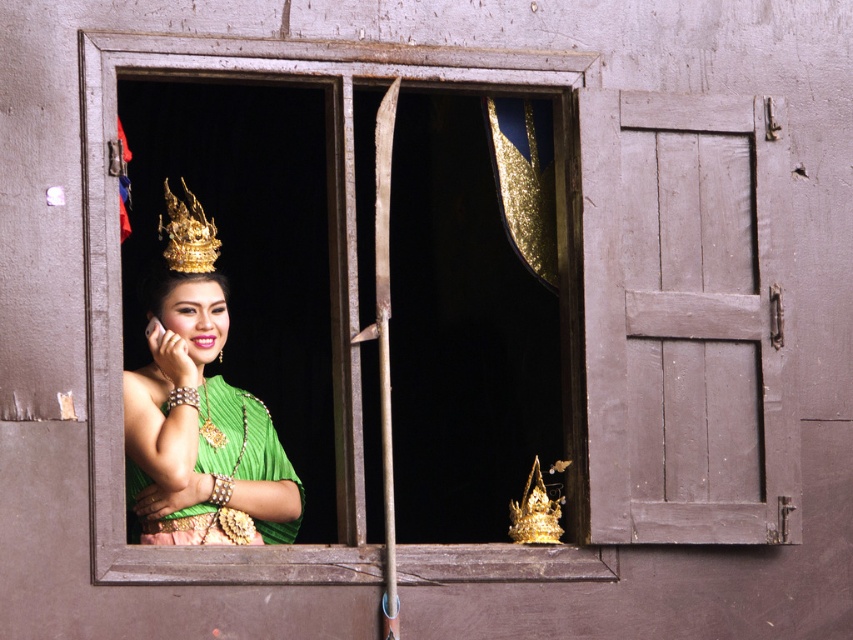
You are an interior designer planning to add a decorative element to the wall. You have a choice between placing a new ornament above or below the green pleated fabric dress at center. Based on the current arrangement, where would the gold metallic crown at upper left be located relative to the dress?

The gold metallic crown at upper left is currently above the green pleated fabric dress at center, so placing the new ornament above the dress would position it at the same level as the crown.

You are standing in front of the window and want to touch the two points on the window frame. Which point would you need to reach out further to touch, point at (247,433) or point at (206,221)?

You would need to reach further to touch point at (206,221) because it is farther from the camera compared to point at (247,433).

You are an interior designer planning to create a display in a small room. You have two items from the image to place there. The green silk dress at center and the green fabric headdress at center. Given the space constraints, which item would you choose to fit better in the display?

The green silk dress at center occupies less space than the green fabric headdress at center, so it would fit better in the small room display.